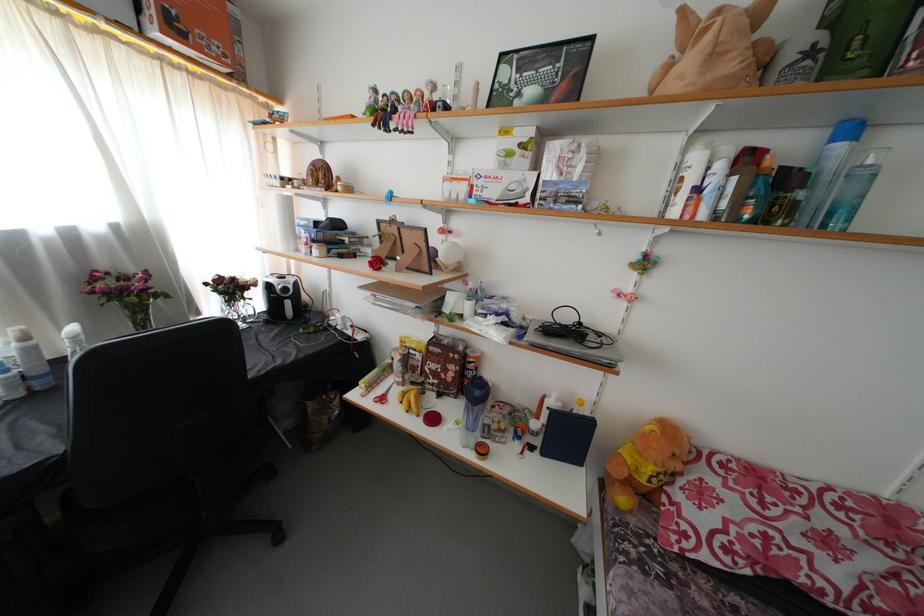
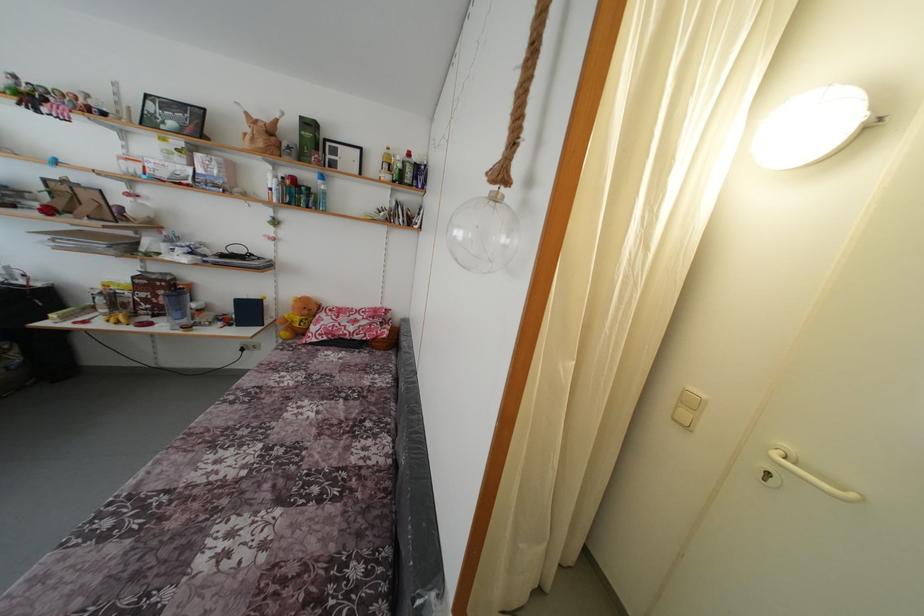
Locate, in the second image, the point that corresponds to point (684, 472) in the first image.

(310, 317)